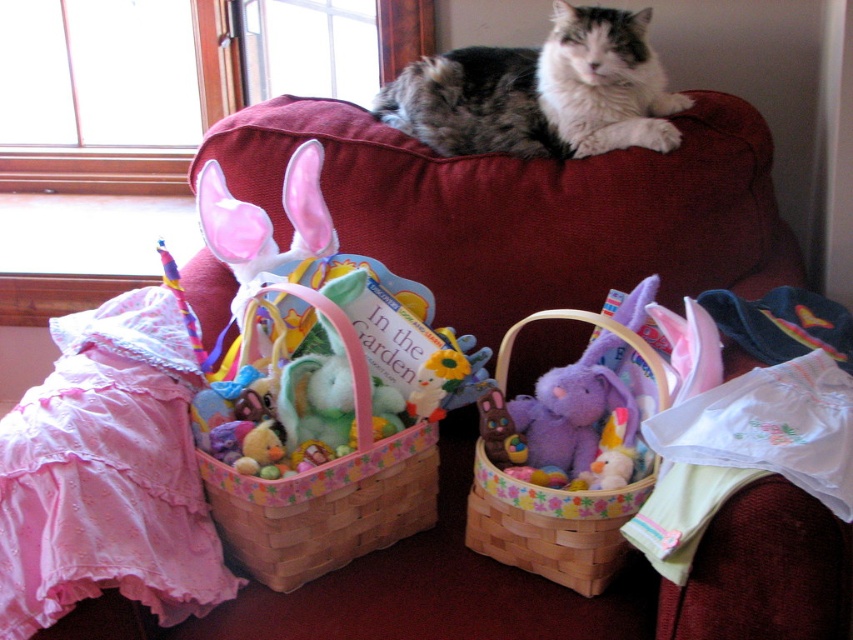
You are trying to place a rectangular cushion that is 1.2 meters wide on the velvet couch at upper center or the wooden woven basket at center. Based on their widths, which one can accommodate the cushion?

The velvet couch at upper center might be wider than wooden woven basket at center, so it is more likely to accommodate the cushion.

You are planning to place a new lamp on the velvet couch at upper center. According to the scene description, where exactly is the velvet couch located in relation to the baskets and other items?

The velvet couch at upper center is located at point coordinates of 0.328 on the x axis and 0.621 on the y axis. However, the scene description does not provide specific spatial relationships between the velvet couch and the baskets or other items mentioned, such as the pink ruffled fabric or folded clothes. Therefore, its exact position relative to those objects cannot be determined beyond its central upper placement.

You are standing in the room and want to place a small vase on the velvet couch at upper center. Can you place it at the point with coordinates point (x=529, y=209)?

Yes, the point (x=529, y=209) is on the velvet couch at upper center, so you can place the vase there.